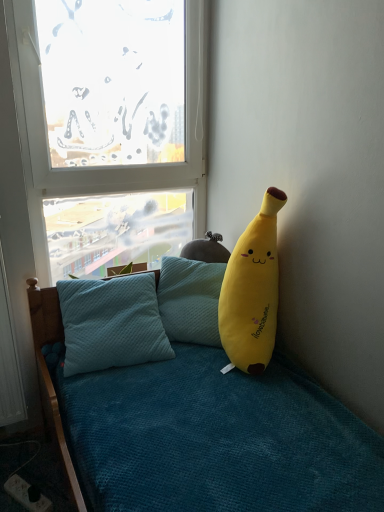
Question: Is black plastic power outlet at lower left shorter than yellow plush at right?

Choices:
 (A) no
 (B) yes

Answer: (B)

Question: From a real-world perspective, is black plastic power outlet at lower left physically above yellow plush at right?

Choices:
 (A) yes
 (B) no

Answer: (B)

Question: Can you confirm if black plastic power outlet at lower left is smaller than yellow plush at right?

Choices:
 (A) yes
 (B) no

Answer: (A)

Question: Is yellow plush at right surrounded by black plastic power outlet at lower left?

Choices:
 (A) yes
 (B) no

Answer: (B)

Question: Does black plastic power outlet at lower left have a larger size compared to yellow plush at right?

Choices:
 (A) yes
 (B) no

Answer: (B)

Question: Based on their sizes in the image, would you say yellow plush at right is bigger or smaller than black plastic power outlet at lower left?

Choices:
 (A) big
 (B) small

Answer: (A)

Question: Would you say yellow plush at right is inside or outside black plastic power outlet at lower left?

Choices:
 (A) inside
 (B) outside

Answer: (B)

Question: Is point (266, 352) closer or farther from the camera than point (26, 507)?

Choices:
 (A) farther
 (B) closer

Answer: (A)

Question: Based on their positions, is yellow plush at right located to the left or right of black plastic power outlet at lower left?

Choices:
 (A) right
 (B) left

Answer: (A)

Question: From a real-world perspective, is black plastic power outlet at lower left above or below transparent glass window at upper left?

Choices:
 (A) above
 (B) below

Answer: (B)

Question: In the image, is black plastic power outlet at lower left positioned in front of or behind transparent glass window at upper left?

Choices:
 (A) behind
 (B) front

Answer: (B)

Question: In the image, is black plastic power outlet at lower left on the left side or the right side of transparent glass window at upper left?

Choices:
 (A) left
 (B) right

Answer: (A)

Question: Is point pos(19,500) positioned closer to the camera than point pos(52,182)?

Choices:
 (A) farther
 (B) closer

Answer: (B)

Question: From the image's perspective, is transparent glass window at upper left positioned above or below yellow plush at right?

Choices:
 (A) below
 (B) above

Answer: (B)

Question: Is transparent glass window at upper left in front of or behind yellow plush at right in the image?

Choices:
 (A) front
 (B) behind

Answer: (B)